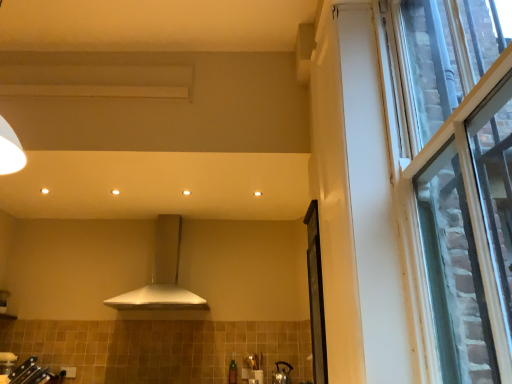
Find the location of `matte silver kettle at lower center`. matte silver kettle at lower center is located at coordinates (282, 373).

The height and width of the screenshot is (384, 512). I want to click on matte silver kettle at lower center, so click(282, 373).

Considering the sizes of objects white matte range hood at center and clear glass window at right in the image provided, who is taller, white matte range hood at center or clear glass window at right?

clear glass window at right is taller.

Is white matte range hood at center directly adjacent to clear glass window at right?

white matte range hood at center is not next to clear glass window at right, and they're not touching.

Which is more to the right, white matte range hood at center or clear glass window at right?

clear glass window at right is more to the right.

Who is bigger, white matte range hood at center or clear glass window at right?

Bigger between the two is white matte range hood at center.

From the image's perspective, between transparent glass screen door at right and white matte range hood at center, which one is located above?

transparent glass screen door at right is shown above in the image.

The height and width of the screenshot is (384, 512). I want to click on screen door on the right of white matte range hood at center, so click(x=316, y=296).

From a real-world perspective, which is physically above, transparent glass screen door at right or white matte range hood at center?

From a 3D spatial view, white matte range hood at center is above.

How different are the orientations of transparent glass screen door at right and white matte range hood at center in degrees?

They differ by 89.3 degrees in their facing directions.

How many degrees apart are the facing directions of white matte range hood at center and matte silver kettle at lower center?

The angular difference between white matte range hood at center and matte silver kettle at lower center is 0.662 degrees.

From a real-world perspective, is white matte range hood at center physically located above or below matte silver kettle at lower center?

white matte range hood at center is situated higher than matte silver kettle at lower center in the real world.

Looking at this image, considering their positions, is white matte range hood at center located in front of or behind matte silver kettle at lower center?

white matte range hood at center is positioned closer to the viewer than matte silver kettle at lower center.

Where is `window above the transparent glass screen door at right (from a real-world perspective)`? The image size is (512, 384). window above the transparent glass screen door at right (from a real-world perspective) is located at coordinates (454, 180).

Is clear glass window at right positioned in front of transparent glass screen door at right?

Yes, clear glass window at right is closer to the viewer.

From the image's perspective, is clear glass window at right on top of transparent glass screen door at right?

Correct, clear glass window at right appears higher than transparent glass screen door at right in the image.

Are white matte range hood at center and transparent glass screen door at right located far from each other?

Absolutely, white matte range hood at center is distant from transparent glass screen door at right.

Based on the photo, considering the positions of objects white matte range hood at center and transparent glass screen door at right in the image provided, who is more to the right, white matte range hood at center or transparent glass screen door at right?

transparent glass screen door at right.

At what (x,y) coordinates should I click in order to perform the action: click on kitchen appliance behind the transparent glass screen door at right. Please return your answer as a coordinate pair (x, y). Looking at the image, I should click on (162, 276).

Measure the distance between white matte range hood at center and transparent glass screen door at right.

They are 1.62 meters apart.

Which of these two, transparent glass screen door at right or clear glass window at right, stands taller?

With more height is clear glass window at right.

Based on the photo, would you consider transparent glass screen door at right to be distant from clear glass window at right?

Yes, transparent glass screen door at right and clear glass window at right are located far from each other.

Which object is positioned more to the right, transparent glass screen door at right or clear glass window at right?

From the viewer's perspective, clear glass window at right appears more on the right side.

Relative to clear glass window at right, is transparent glass screen door at right in front or behind?

transparent glass screen door at right is positioned farther from the viewer than clear glass window at right.

Does clear glass window at right have a lesser width compared to white matte range hood at center?

Indeed, clear glass window at right has a lesser width compared to white matte range hood at center.

Does clear glass window at right have a lesser height compared to white matte range hood at center?

No, clear glass window at right is not shorter than white matte range hood at center.

Is white matte range hood at center inside clear glass window at right?

No, clear glass window at right does not contain white matte range hood at center.

Is clear glass window at right aimed at white matte range hood at center?

No.

In order to click on window in front of the white matte range hood at center in this screenshot , I will do `click(454, 180)`.

In the image, there is a white matte range hood at center. What are the coordinates of `screen door above it (from the image's perspective)` in the screenshot? It's located at (316, 296).

Based on their spatial positions, is transparent glass screen door at right or white matte range hood at center further from clear glass window at right?

white matte range hood at center lies further to clear glass window at right than the other object.

Which object lies further to the anchor point matte silver kettle at lower center, white matte range hood at center or clear glass window at right?

Among the two, clear glass window at right is located further to matte silver kettle at lower center.

Considering their positions, is white matte range hood at center positioned closer to transparent glass screen door at right than clear glass window at right?

clear glass window at right.

Estimate the real-world distances between objects in this image. Which object is further from transparent glass screen door at right, clear glass window at right or matte silver kettle at lower center?

matte silver kettle at lower center.

Estimate the real-world distances between objects in this image. Which object is closer to matte silver kettle at lower center, transparent glass screen door at right or white matte range hood at center?

white matte range hood at center.

Considering their positions, is clear glass window at right positioned further to white matte range hood at center than matte silver kettle at lower center?

The object further to white matte range hood at center is clear glass window at right.

Looking at the image, which one is located further to transparent glass screen door at right, matte silver kettle at lower center or white matte range hood at center?

white matte range hood at center lies further to transparent glass screen door at right than the other object.

Considering their positions, is matte silver kettle at lower center positioned closer to clear glass window at right than transparent glass screen door at right?

transparent glass screen door at right is closer to clear glass window at right.

Where is `kitchen appliance between transparent glass screen door at right and matte silver kettle at lower center in the front-back direction`? kitchen appliance between transparent glass screen door at right and matte silver kettle at lower center in the front-back direction is located at coordinates (162, 276).

The width and height of the screenshot is (512, 384). I want to click on screen door located between clear glass window at right and white matte range hood at center in the depth direction, so click(x=316, y=296).

This screenshot has width=512, height=384. What are the coordinates of `screen door between clear glass window at right and matte silver kettle at lower center from front to back` in the screenshot? It's located at (316, 296).

Image resolution: width=512 pixels, height=384 pixels. Identify the location of kitchen appliance between clear glass window at right and matte silver kettle at lower center along the z-axis. (162, 276).